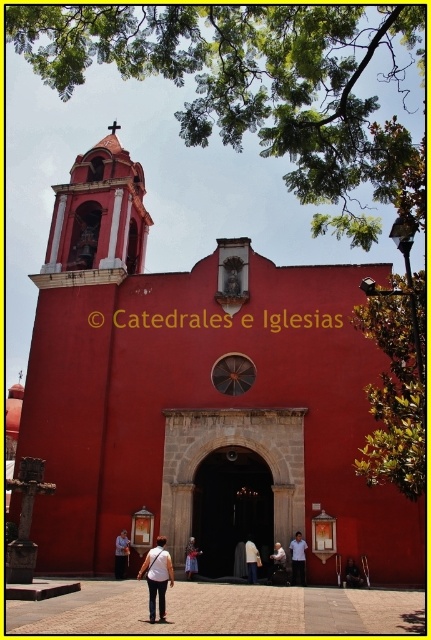
You are standing in front of the church and notice two items at the center of the image. What is the height relationship between the white fabric dress at center and the dark blue jeans at center?

The white fabric dress at center is much taller than the dark blue jeans at center.

You are standing in front of the red church and see a denim jacket at center and a white fabric shirt at center. Which clothing item is positioned to the left?

The denim jacket at center is to the left of the white fabric shirt at center.

You are standing in front of the red church and want to take a photo. You notice two points marked on the church facade at coordinates point (116, 570) and point (259, 563). Which point is closer to your camera lens?

Point (116, 570) is further to the camera than point (259, 563). Therefore, point (259, 563) is closer to the camera lens.